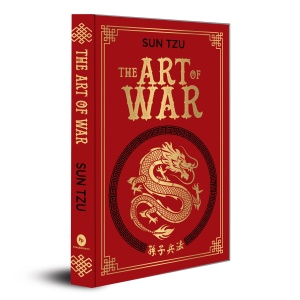
At what (x,y) coordinates should I click in order to perform the action: click on cover. Please return your answer as a coordinate pair (x, y). Looking at the image, I should click on [199, 128].